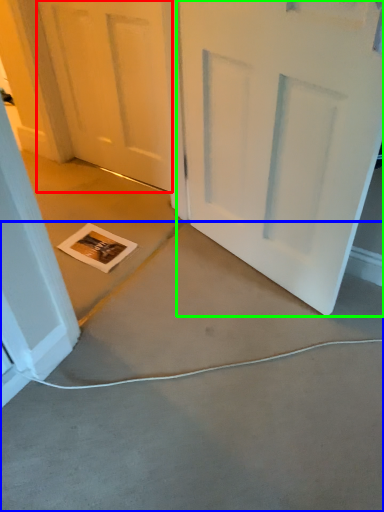
Question: Which is nearer to the door (highlighted by a red box)? concrete (highlighted by a blue box) or door (highlighted by a green box).

Choices:
 (A) concrete
 (B) door

Answer: (B)